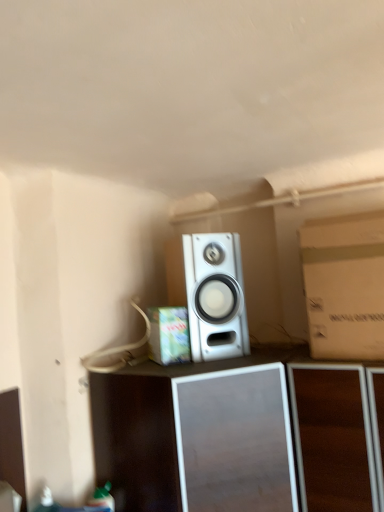
Question: From the image's perspective, is cardboard box at center, placed as the second cardboard box when sorted from right to left, on top of brown cardboard box at right, arranged as the 2th cardboard box when viewed from the left?

Choices:
 (A) yes
 (B) no

Answer: (B)

Question: Is cardboard box at center, the first cardboard box viewed from the left, at the left side of brown cardboard box at right, the first cardboard box from the right?

Choices:
 (A) yes
 (B) no

Answer: (A)

Question: Can brown cardboard box at right, arranged as the 2th cardboard box when viewed from the left, be found inside cardboard box at center, placed as the second cardboard box when sorted from right to left?

Choices:
 (A) no
 (B) yes

Answer: (A)

Question: Can you confirm if cardboard box at center, placed as the second cardboard box when sorted from right to left, is wider than brown cardboard box at right, the first cardboard box from the right?

Choices:
 (A) no
 (B) yes

Answer: (A)

Question: Considering the relative positions of cardboard box at center, the first cardboard box viewed from the left, and brown cardboard box at right, arranged as the 2th cardboard box when viewed from the left, in the image provided, is cardboard box at center, the first cardboard box viewed from the left, in front of brown cardboard box at right, arranged as the 2th cardboard box when viewed from the left,?

Choices:
 (A) no
 (B) yes

Answer: (A)

Question: Looking at their shapes, would you say silver metallic speaker at center is wider or thinner than brown cardboard box at right, the first cardboard box from the right?

Choices:
 (A) wide
 (B) thin

Answer: (A)

Question: Would you say silver metallic speaker at center is to the left or to the right of brown cardboard box at right, the first cardboard box from the right, in the picture?

Choices:
 (A) right
 (B) left

Answer: (B)

Question: Looking at the image, does silver metallic speaker at center seem bigger or smaller compared to brown cardboard box at right, the first cardboard box from the right?

Choices:
 (A) big
 (B) small

Answer: (A)

Question: From a real-world perspective, relative to brown cardboard box at right, the first cardboard box from the right, is silver metallic speaker at center vertically above or below?

Choices:
 (A) above
 (B) below

Answer: (B)

Question: Does point (218, 241) appear closer or farther from the camera than point (337, 328)?

Choices:
 (A) closer
 (B) farther

Answer: (B)

Question: In terms of size, does silver metallic speaker at center appear bigger or smaller than brown cardboard box at right, arranged as the 2th cardboard box when viewed from the left?

Choices:
 (A) big
 (B) small

Answer: (B)

Question: Considering the positions of silver metallic speaker at center and brown cardboard box at right, the first cardboard box from the right, in the image, is silver metallic speaker at center taller or shorter than brown cardboard box at right, the first cardboard box from the right,?

Choices:
 (A) short
 (B) tall

Answer: (A)

Question: Is silver metallic speaker at center to the left or to the right of brown cardboard box at right, the first cardboard box from the right, in the image?

Choices:
 (A) left
 (B) right

Answer: (A)

Question: Would you say brown cardboard box at right, arranged as the 2th cardboard box when viewed from the left, is to the left or to the right of silver metallic speaker at center in the picture?

Choices:
 (A) left
 (B) right

Answer: (B)

Question: Is brown cardboard box at right, arranged as the 2th cardboard box when viewed from the left, wider or thinner than silver metallic speaker at center?

Choices:
 (A) thin
 (B) wide

Answer: (A)